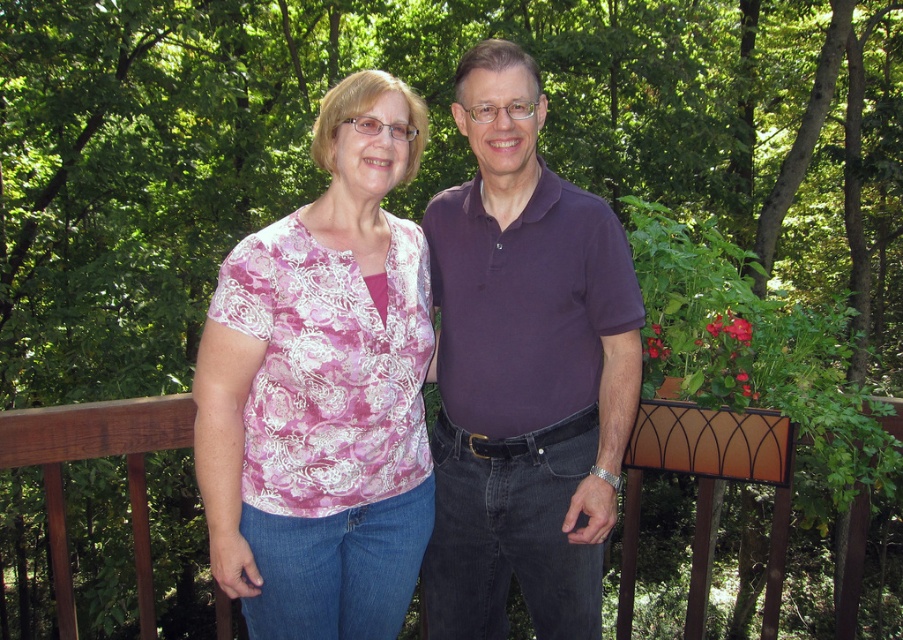
You are a photographer trying to capture a portrait of the purple cotton shirt at center. The camera you are using has a focal length of 50mm. Based on the given coordinates, can you estimate whether the shirt is positioned within the central 30x30 pixel area of the image frame?

The purple cotton shirt at center is located at coordinates approximately [524,371], which falls within the central 30x30 pixel area of the image frame. Therefore, it is positioned correctly for the portrait.

You are a photographer trying to capture a portrait of the two people in the scene. The purple cotton shirt at center and brown wooden rail at center are both in the frame. Which object is taller in the image?

The purple cotton shirt at center is taller than the brown wooden rail at center according to the description.

Looking at this image, you are standing on the wooden deck and want to walk towards the point that is closer to you. Which point should you head towards, point (368, 192) or point (489, 147)?

You should head towards point (368, 192) because it is closer to the viewer than point (489, 147).